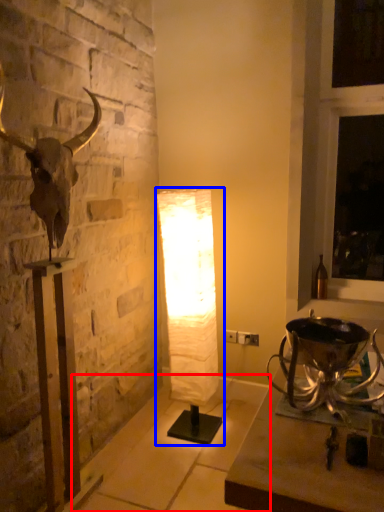
Question: Which point is further to the camera, concrete (highlighted by a red box) or lamp (highlighted by a blue box)?

Choices:
 (A) concrete
 (B) lamp

Answer: (B)